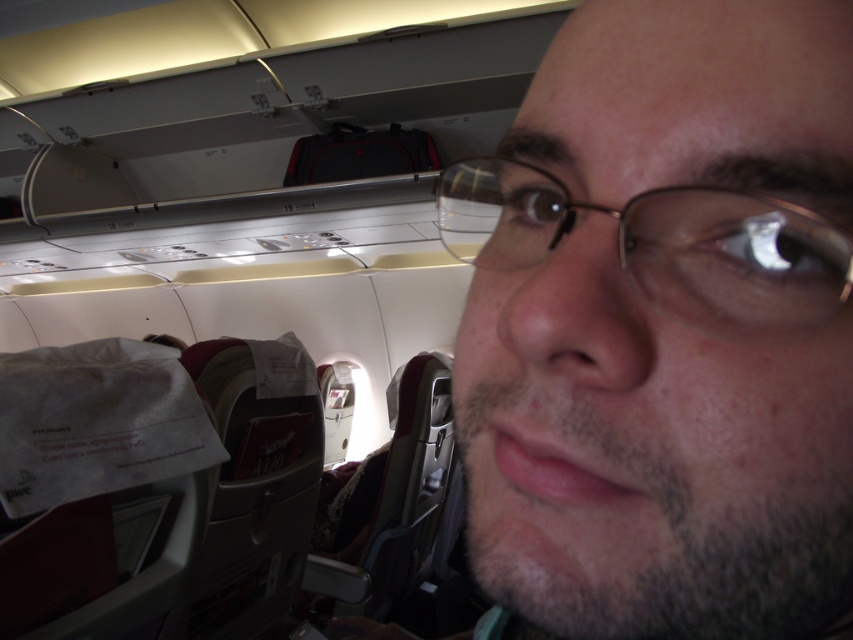
Is smooth skin face at center to the left of gold-framed glasses at center from the viewer's perspective?

No, smooth skin face at center is not to the left of gold-framed glasses at center.

Is smooth skin face at center thinner than gold-framed glasses at center?

No, smooth skin face at center is not thinner than gold-framed glasses at center.

You are a GUI agent. You are given a task and a screenshot of the screen. Output one action in this format:
    pyautogui.click(x=<x>, y=<y>)
    Task: Click on the smooth skin face at center
    The width and height of the screenshot is (853, 640).
    Given the screenshot: What is the action you would take?
    pyautogui.click(x=656, y=330)